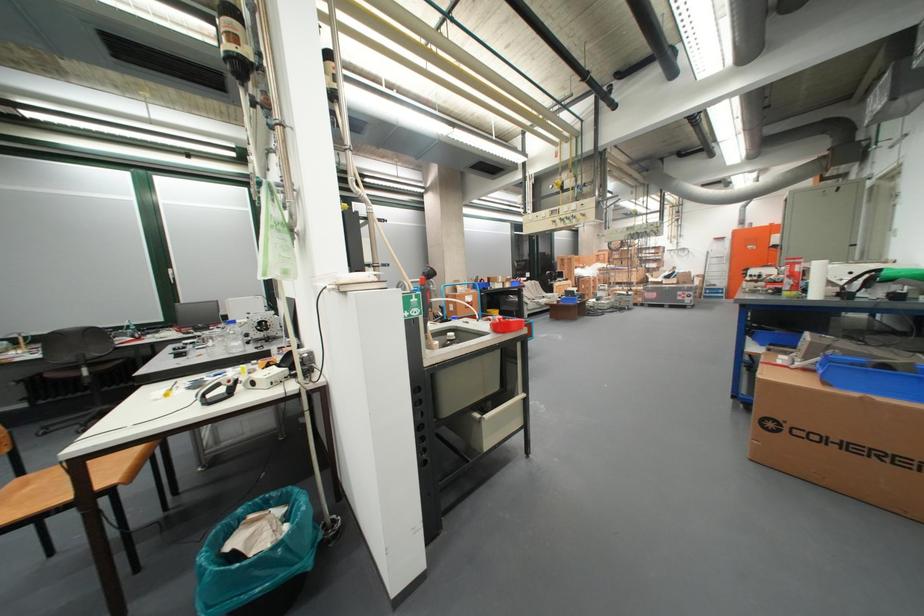
What do you see at coordinates (217, 391) in the screenshot? The width and height of the screenshot is (924, 616). I see `the eyewash station lever` at bounding box center [217, 391].